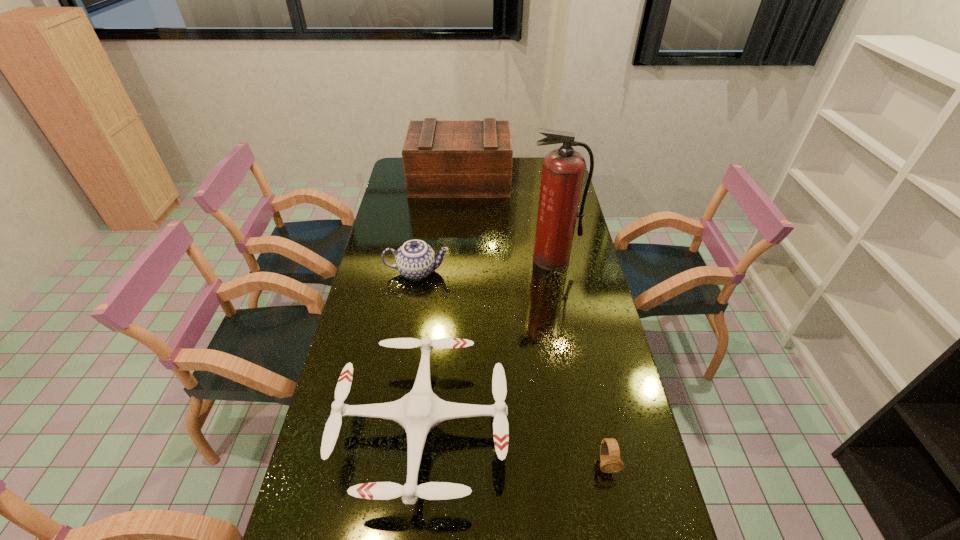
Identify the location of free space that is in between the second shortest object and the chinaware. (420, 350).

Image resolution: width=960 pixels, height=540 pixels. In order to click on free point between the third shortest object and the tallest object in this screenshot , I will do click(x=485, y=266).

This screenshot has height=540, width=960. Find the location of `free spot between the chinaware and the watch`. free spot between the chinaware and the watch is located at coordinates (512, 368).

At what (x,y) coordinates should I click in order to perform the action: click on vacant point located between the shortest object and the box. Please return your answer as a coordinate pair (x, y). Looking at the image, I should click on (533, 322).

This screenshot has width=960, height=540. In order to click on free spot between the chinaware and the shortest object in this screenshot , I will do `click(512, 368)`.

Locate which object ranks in proximity to the shortest object. Please provide its 2D coordinates. Your answer should be formatted as a tuple, i.e. [(x, y)], where the tuple contains the x and y coordinates of a point satisfying the conditions above.

[(420, 410)]

Point out which object is positioned as the second nearest to the chinaware. Please provide its 2D coordinates. Your answer should be formatted as a tuple, i.e. [(x, y)], where the tuple contains the x and y coordinates of a point satisfying the conditions above.

[(420, 410)]

Find the location of a particular element. free space that satisfies the following two spatial constraints: 1. at the nozzle of the fire extinguisher; 2. from the spout of the third tallest object is located at coordinates (554, 272).

Identify the location of vacant area that satisfies the following two spatial constraints: 1. at the nozzle of the fire extinguisher; 2. from the spout of the chinaware. (554, 272).